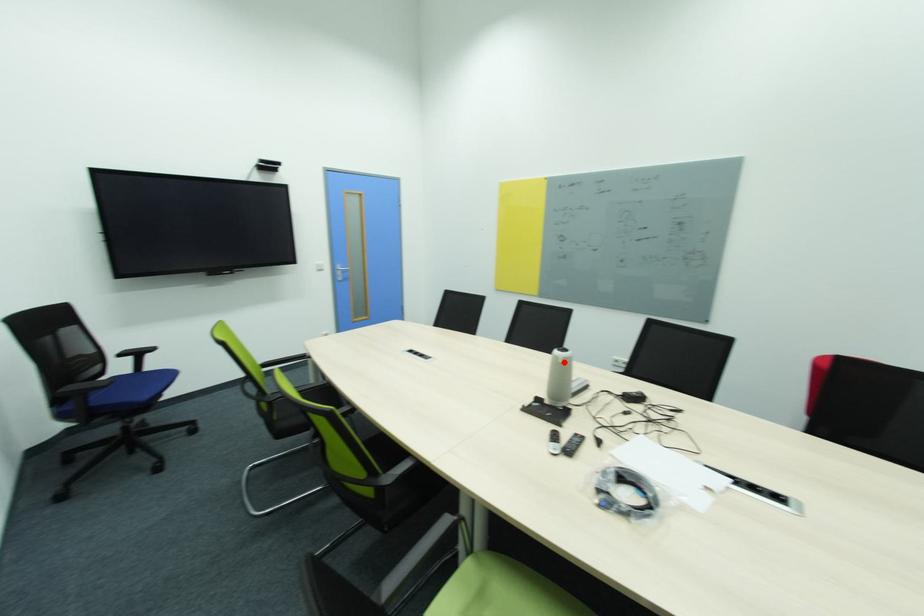
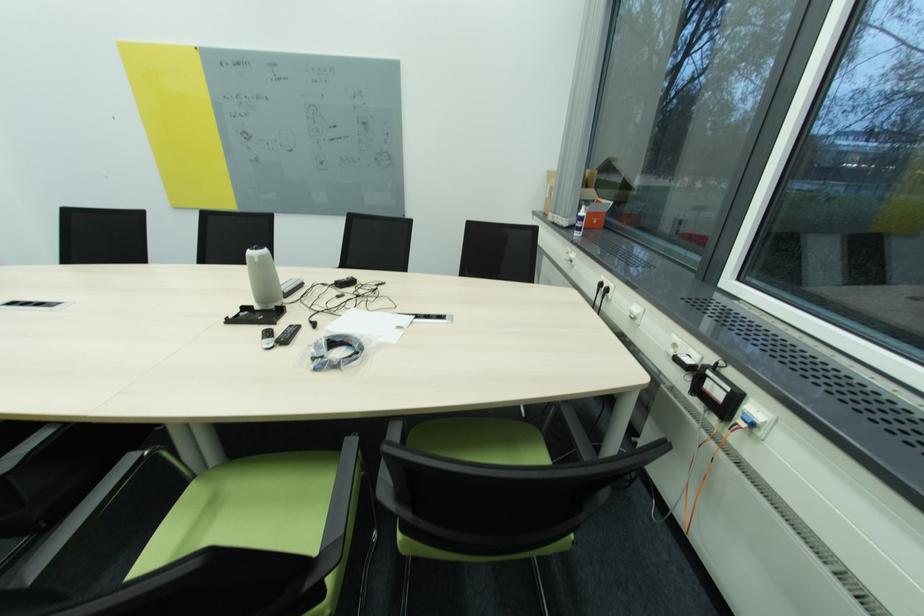
Where in the second image is the point corresponding to the highlighted location from the first image?

(261, 262)